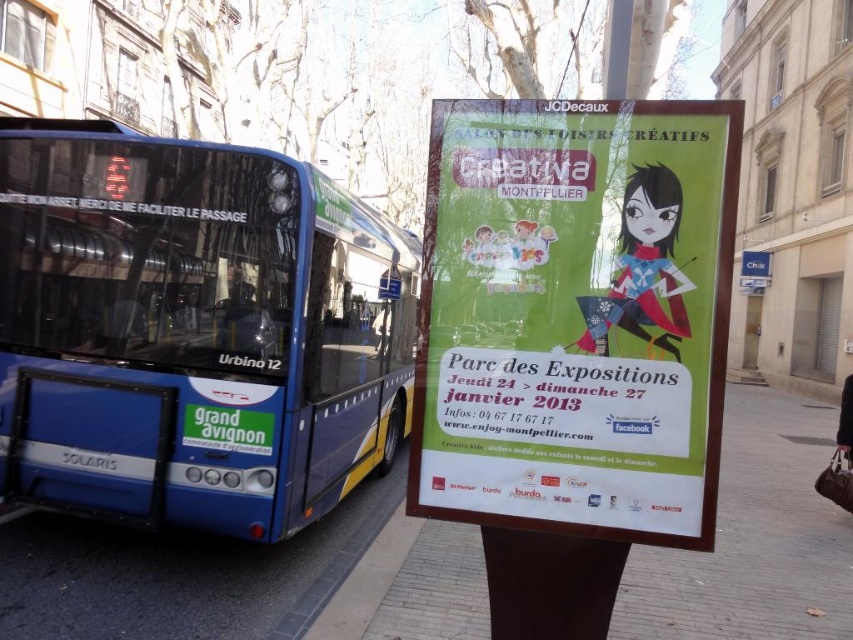
You are a delivery person who needs to drive a truck that is 2.5 meters tall through the space between the blue metallic bus at left and the smooth concrete pavement at center. Can your truck pass through without hitting anything?

The blue metallic bus at left is taller than the smooth concrete pavement at center. Since the truck is 2.5 meters tall, it might hit the blue metallic bus at left if the pavement is lower, but the exact height difference isn

You are a pedestrian standing between the blue metallic bus at left and the green paper poster at right. You want to reach the poster first before the bus driver can spot you. The bus driver can only see forward. Can you safely walk to the poster without being seen by the driver?

The blue metallic bus at left is 9.38 feet from green paper poster at right. Since the bus driver can only see forward, and you are standing between the bus and the poster, walking towards the poster would keep you in the driver blind spot, so yes, you can safely walk to the green paper poster at right without being seen by the driver.